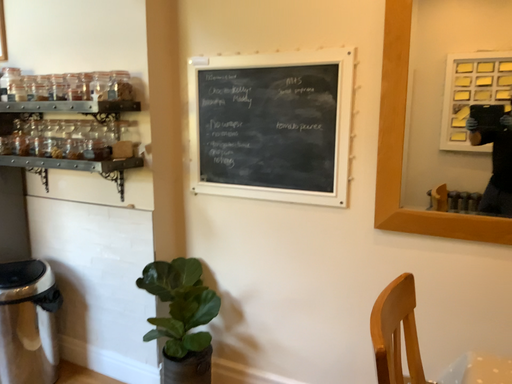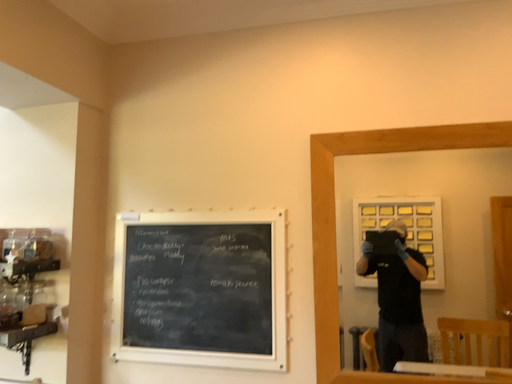
Question: How did the camera likely rotate when shooting the video?

Choices:
 (A) rotated downward
 (B) rotated upward

Answer: (B)